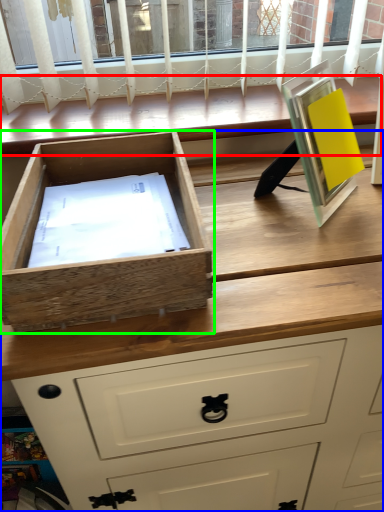
Question: Based on their relative distances, which object is farther from window (highlighted by a red box)? Choose from chest of drawers (highlighted by a blue box) and drawer (highlighted by a green box).

Choices:
 (A) chest of drawers
 (B) drawer

Answer: (A)